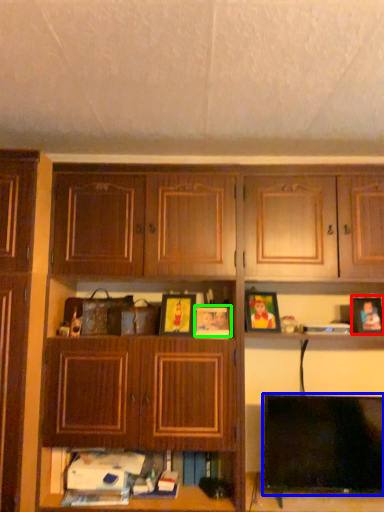
Question: Which object is the farthest from picture frame (highlighted by a red box)? Choose among these: television (highlighted by a blue box) or picture frame (highlighted by a green box).

Choices:
 (A) television
 (B) picture frame

Answer: (B)